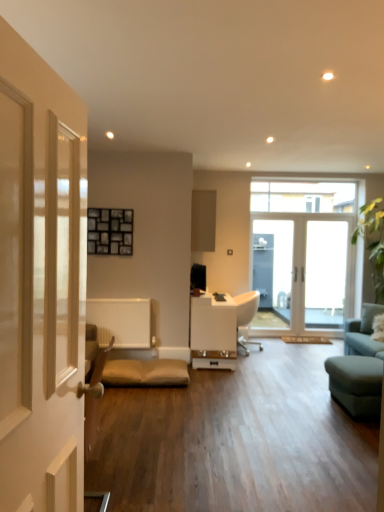
Question: Is teal fabric studio couch at right at the right side of matte wood cabinet at center?

Choices:
 (A) yes
 (B) no

Answer: (A)

Question: Is teal fabric studio couch at right shorter than matte wood cabinet at center?

Choices:
 (A) yes
 (B) no

Answer: (B)

Question: Does teal fabric studio couch at right come behind matte wood cabinet at center?

Choices:
 (A) yes
 (B) no

Answer: (B)

Question: Is teal fabric studio couch at right at the left side of matte wood cabinet at center?

Choices:
 (A) no
 (B) yes

Answer: (A)

Question: From the image's perspective, is teal fabric studio couch at right under matte wood cabinet at center?

Choices:
 (A) yes
 (B) no

Answer: (A)

Question: From the image's perspective, is teal fabric studio couch at right on matte wood cabinet at center?

Choices:
 (A) yes
 (B) no

Answer: (B)

Question: Can you confirm if teal fabric studio couch at right is positioned to the left of transparent glass door at center?

Choices:
 (A) yes
 (B) no

Answer: (B)

Question: Is teal fabric studio couch at right far from transparent glass door at center?

Choices:
 (A) yes
 (B) no

Answer: (A)

Question: Is teal fabric studio couch at right turned away from transparent glass door at center?

Choices:
 (A) no
 (B) yes

Answer: (A)

Question: Is teal fabric studio couch at right not inside transparent glass door at center?

Choices:
 (A) no
 (B) yes

Answer: (B)

Question: Is teal fabric studio couch at right next to transparent glass door at center?

Choices:
 (A) no
 (B) yes

Answer: (A)

Question: From a real-world perspective, is teal fabric studio couch at right beneath transparent glass door at center?

Choices:
 (A) no
 (B) yes

Answer: (B)

Question: Does transparent glass door at center have a larger size compared to white glossy table at center?

Choices:
 (A) yes
 (B) no

Answer: (B)